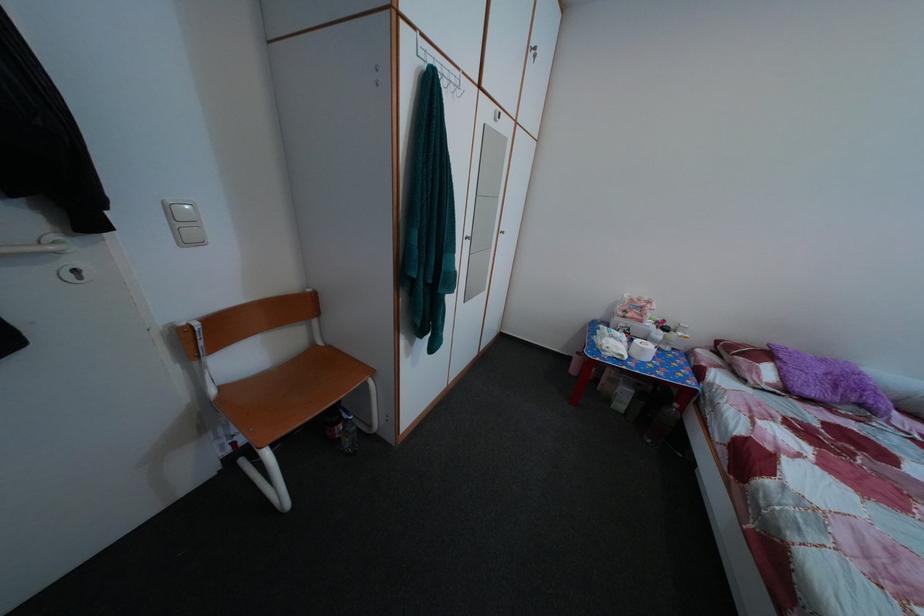
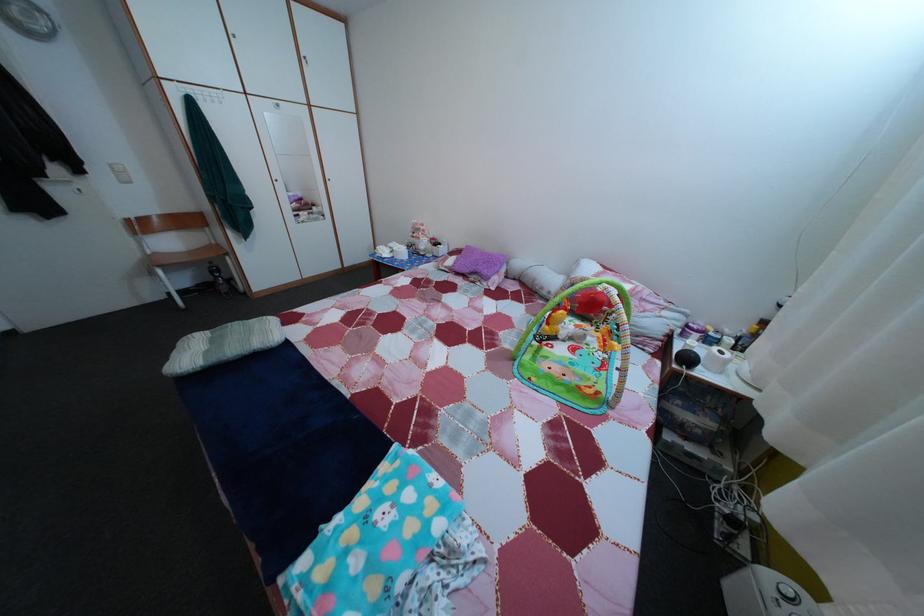
In a continuous first-person perspective shot, in which direction is the camera moving?

The cameraman walked toward right, backward.